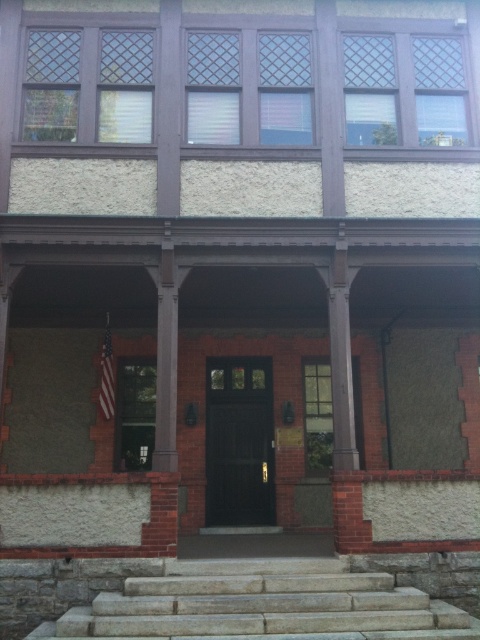
You are standing in front of the building and want to approach the entrance. The gray stone stairs at lower center and the red fabric american flag at center are in your path. Which object do you need to step over or around first?

The gray stone stairs at lower center is in front of the red fabric american flag at center, so you would need to step over or around the gray stone stairs at lower center first before reaching the red fabric american flag at center.

You are standing in front of the building and want to place a small potted plant on the gray stone stairs at lower center. However, you also want to ensure that the red fabric american flag at center remains visible from your current position. Will placing the plant on the stairs block the view of the flag?

The gray stone stairs at lower center is shorter than the red fabric american flag at center, so placing the plant on the stairs will not block the view of the flag as the flag is taller and will remain visible.

You are standing in front of the building and want to enter through the shiny dark wood door at center. However, there is a red fabric american flag at center in the way. To reach the door, should you move to the left or right of the flag?

The shiny dark wood door at center is positioned on the right side of the red fabric american flag at center, so you should move to the right of the flag to reach the door.